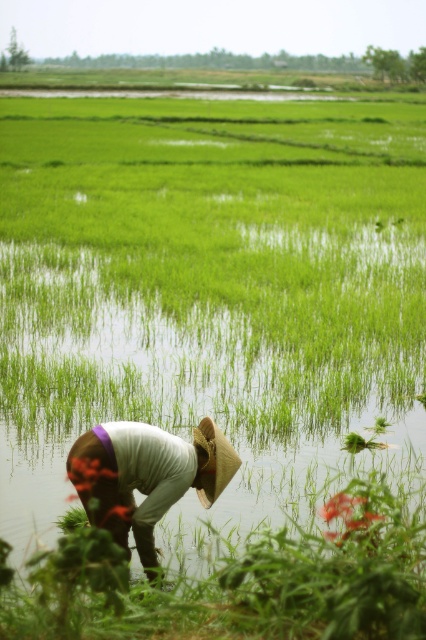
Looking at this image, does white cotton shirt at lower center have a greater width compared to strawmaterial/texturehat at lower center?

Yes, white cotton shirt at lower center is wider than strawmaterial/texturehat at lower center.

Is point (140, 467) less distant than point (204, 474)?

Yes, point (140, 467) is in front of point (204, 474).

Where is `white cotton shirt at lower center`? This screenshot has width=426, height=640. white cotton shirt at lower center is located at coordinates 146,476.

Image resolution: width=426 pixels, height=640 pixels. I want to click on white cotton shirt at lower center, so click(146, 476).